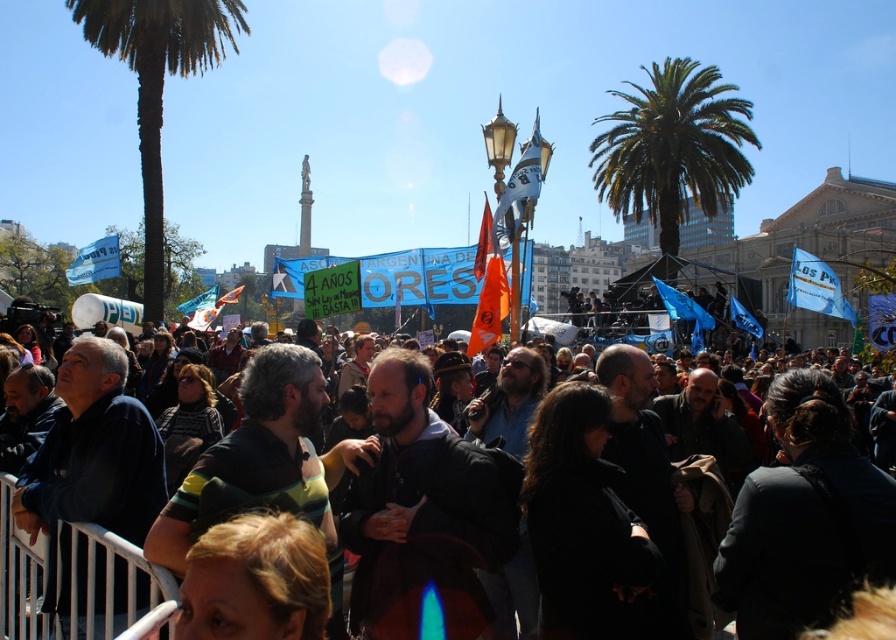
In the scene shown: You are a photographer trying to capture the central banner and the crowd. You notice the green leafy palm tree at upper right and the dark clothing crowd at center. Which object is located to the right of the other?

The green leafy palm tree at upper right is positioned on the right side of dark clothing crowd at center.

You are a photographer at the protest event. You want to take a photo that includes both the green leafy palm tree at upper right and the dark clothing crowd at center. Which object will appear thinner in the photo?

The green leafy palm tree at upper right will appear thinner in the photo than the dark clothing crowd at center because it is thinner than the dark clothing crowd at center.

You are a photographer trying to capture a clear shot of the central banner. You notice two green leafy palm trees in the frame. Which palm tree is closer to the camera, the green leafy palm tree at upper right or the green leafy palm tree at left?

The green leafy palm tree at upper right is shorter than the green leafy palm tree at left, so the shorter one is closer to the camera.